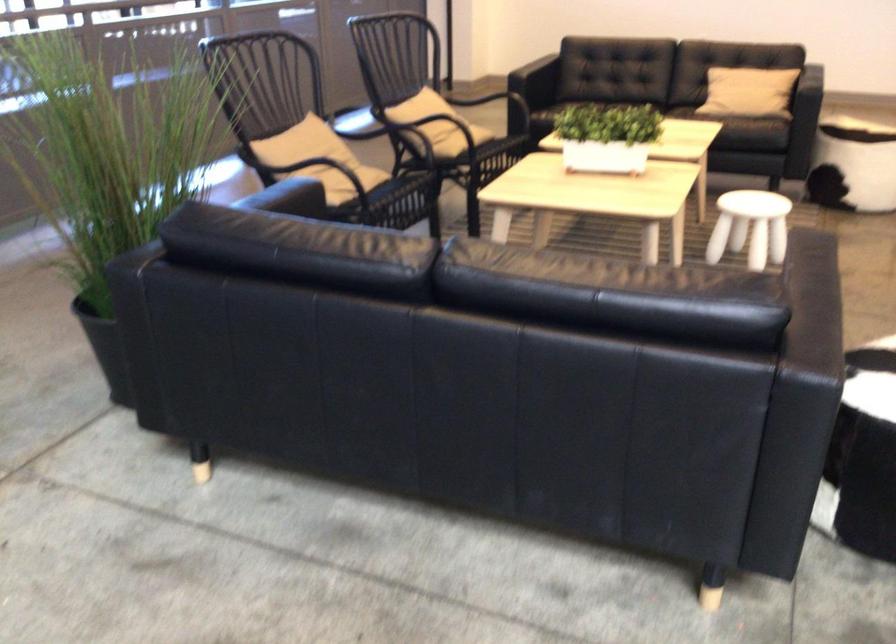
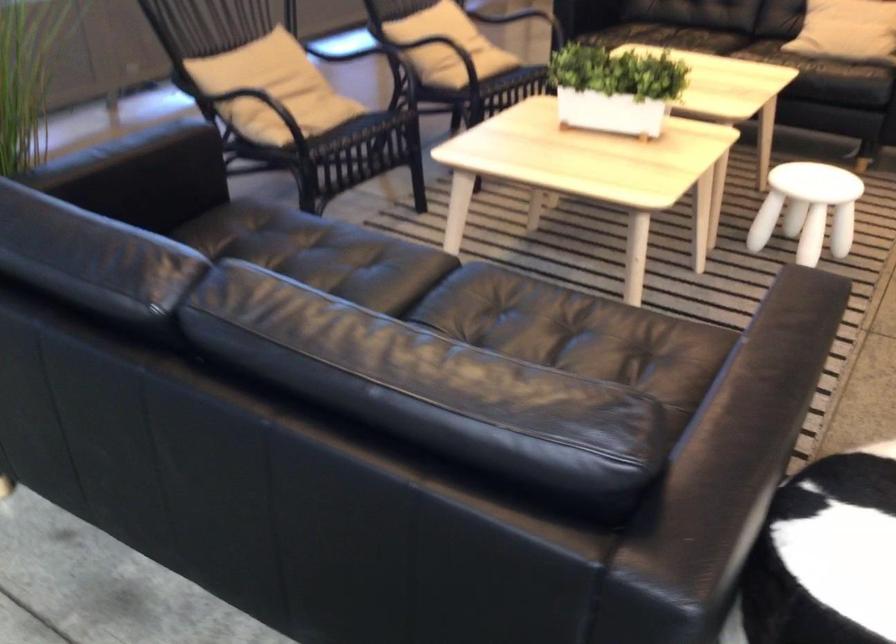
Question: The first image is from the beginning of the video and the second image is from the end. How did the camera likely rotate when shooting the video?

Choices:
 (A) Left
 (B) Right
 (C) Up
 (D) Down

Answer: (D)